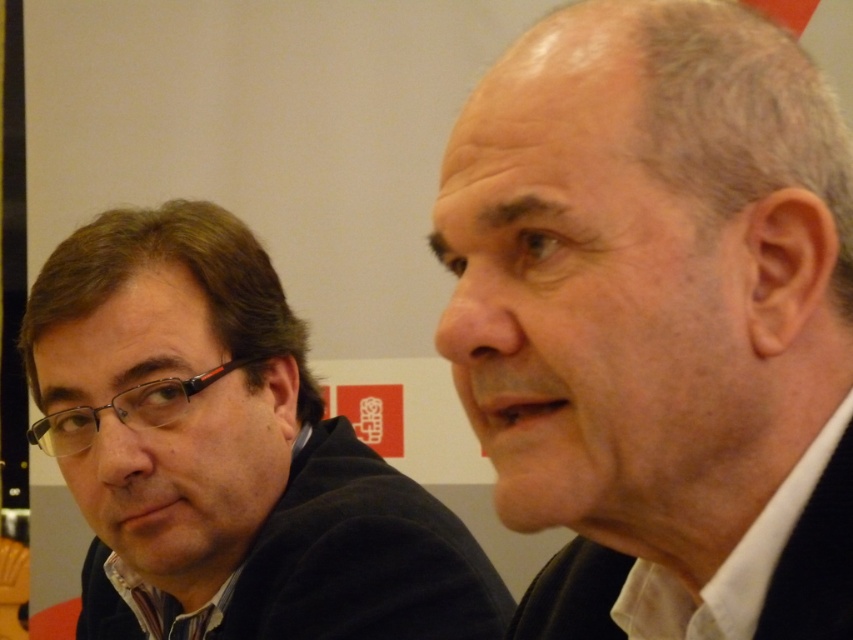
Is point (543, 150) positioned behind point (73, 396)?

No, it is not.

Is white matte suit at center to the left of dark brown hair at left from the viewer's perspective?

Incorrect, white matte suit at center is not on the left side of dark brown hair at left.

Who is more forward, (515, 456) or (251, 560)?

Point (515, 456) is in front.

Identify the location of white matte suit at center. (659, 320).